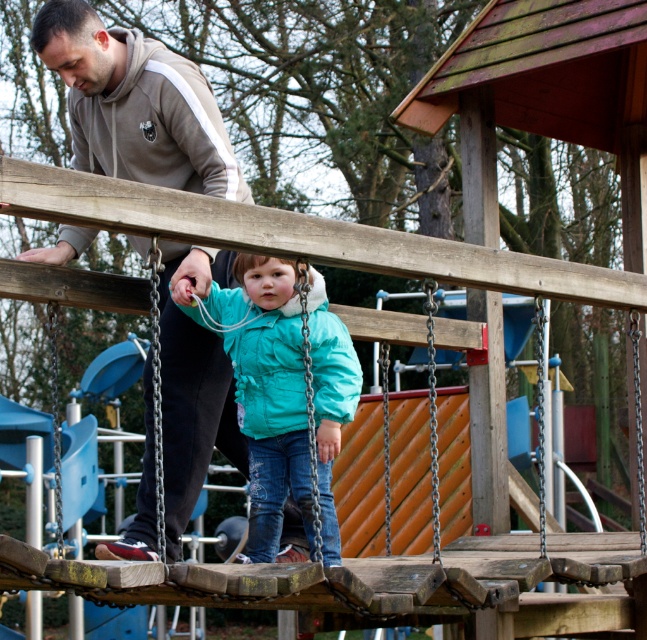
You are a clothing designer observing the playground scene. You need to determine which jacket, the gray fleece jacket at upper left or the turquoise matte jacket at center, would be more suitable for a child who needs a wider jacket for layering. Based on the scene description, which jacket should you recommend?

The turquoise matte jacket at center has a greater width than the gray fleece jacket at upper left, so it would be more suitable for a child needing a wider jacket for layering.

You are a parent at the playground. You see the gray fleece jacket at upper left and the turquoise matte jacket at center. Which jacket is covering the other one in the image?

The gray fleece jacket at upper left is positioned over the turquoise matte jacket at center, so it is covering the other one.